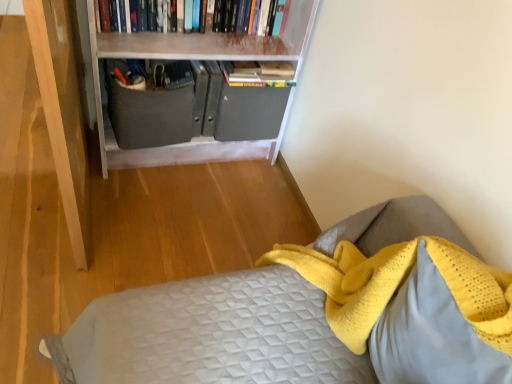
Describe the element at coordinates (431, 335) in the screenshot. This screenshot has width=512, height=384. I see `yellow knitted pillow at lower right` at that location.

The width and height of the screenshot is (512, 384). Identify the location of yellow knitted pillow at lower right. (431, 335).

Find the location of a particular element. This screenshot has width=512, height=384. hardcover books at upper center is located at coordinates (248, 16).

Where is `white matte bookcase at upper center`? white matte bookcase at upper center is located at coordinates (199, 91).

Who is taller, matte gray drawer at center or hardcover books at upper center?

matte gray drawer at center is taller.

Is matte gray drawer at center positioned with its back to hardcover books at upper center?

matte gray drawer at center is not turned away from hardcover books at upper center.

Considering the positions of objects matte gray drawer at center and hardcover books at upper center in the image provided, who is more to the right, matte gray drawer at center or hardcover books at upper center?

hardcover books at upper center.

Is there a large distance between matte gray drawer at center and hardcover books at upper center?

matte gray drawer at center is near hardcover books at upper center, not far away.

Is yellow knitted pillow at lower right wider than matte gray drawer at center?

No, yellow knitted pillow at lower right is not wider than matte gray drawer at center.

Is yellow knitted pillow at lower right facing towards matte gray drawer at center?

No, yellow knitted pillow at lower right is not oriented towards matte gray drawer at center.

Is yellow knitted pillow at lower right taller than matte gray drawer at center?

Indeed, yellow knitted pillow at lower right has a greater height compared to matte gray drawer at center.

Is yellow knitted pillow at lower right directly adjacent to matte gray drawer at center?

No, yellow knitted pillow at lower right is not making contact with matte gray drawer at center.

Measure the distance from yellow knitted pillow at lower right to white matte bookcase at upper center.

A distance of 4.13 feet exists between yellow knitted pillow at lower right and white matte bookcase at upper center.

Is yellow knitted pillow at lower right not within white matte bookcase at upper center?

yellow knitted pillow at lower right is positioned outside white matte bookcase at upper center.

From a real-world perspective, is yellow knitted pillow at lower right physically above white matte bookcase at upper center?

Yes, from a real-world perspective, yellow knitted pillow at lower right is above white matte bookcase at upper center.

I want to click on bookcase that appears above the yellow knitted pillow at lower right (from the image's perspective), so click(x=199, y=91).

Consider the image. Which object is further away from the camera taking this photo, yellow knitted pillow at lower right or hardcover books at upper center?

hardcover books at upper center is behind.

Can hardcover books at upper center be found inside yellow knitted pillow at lower right?

No, hardcover books at upper center is not inside yellow knitted pillow at lower right.

Is point (479, 341) behind point (271, 18)?

No, (479, 341) is closer to viewer.

Is yellow knitted pillow at lower right bigger or smaller than hardcover books at upper center?

In the image, yellow knitted pillow at lower right appears to be smaller than hardcover books at upper center.

How many degrees apart are the facing directions of matte gray drawer at center and yellow knitted pillow at lower right?

The angular difference between matte gray drawer at center and yellow knitted pillow at lower right is 95.8 degrees.

Considering the relative positions of matte gray drawer at center and yellow knitted pillow at lower right in the image provided, is matte gray drawer at center to the right of yellow knitted pillow at lower right from the viewer's perspective?

No, matte gray drawer at center is not to the right of yellow knitted pillow at lower right.

Considering the points (172, 132) and (487, 365), which point is behind, point (172, 132) or point (487, 365)?

The point (172, 132) is behind.

Locate an element on the screen. book behind the yellow knitted pillow at lower right is located at coordinates click(248, 16).

Is hardcover books at upper center smaller than yellow knitted pillow at lower right?

Actually, hardcover books at upper center might be larger than yellow knitted pillow at lower right.

From a real-world perspective, between hardcover books at upper center and yellow knitted pillow at lower right, who is vertically higher?

From a 3D spatial view, hardcover books at upper center is above.

Is hardcover books at upper center taller than yellow knitted pillow at lower right?

No, hardcover books at upper center is not taller than yellow knitted pillow at lower right.

Considering the sizes of objects white matte bookcase at upper center and yellow knitted pillow at lower right in the image provided, who is bigger, white matte bookcase at upper center or yellow knitted pillow at lower right?

Bigger between the two is white matte bookcase at upper center.

What's the angular difference between white matte bookcase at upper center and yellow knitted pillow at lower right's facing directions?

There is a 93.4-degree angle between the facing directions of white matte bookcase at upper center and yellow knitted pillow at lower right.

Does white matte bookcase at upper center turn towards yellow knitted pillow at lower right?

Yes, white matte bookcase at upper center is facing yellow knitted pillow at lower right.

Is white matte bookcase at upper center thinner than yellow knitted pillow at lower right?

No.

The height and width of the screenshot is (384, 512). I want to click on book positioned vertically above the matte gray drawer at center (from a real-world perspective), so click(x=248, y=16).

The height and width of the screenshot is (384, 512). Find the location of `pillow in front of the matte gray drawer at center`. pillow in front of the matte gray drawer at center is located at coordinates (431, 335).

Based on their spatial positions, is white matte bookcase at upper center or matte gray drawer at center further from yellow knitted pillow at lower right?

The object further to yellow knitted pillow at lower right is matte gray drawer at center.

Looking at the image, which one is located further to white matte bookcase at upper center, matte gray drawer at center or hardcover books at upper center?

hardcover books at upper center.

Looking at the image, which one is located closer to white matte bookcase at upper center, yellow knitted pillow at lower right or hardcover books at upper center?

Based on the image, hardcover books at upper center appears to be nearer to white matte bookcase at upper center.

Considering their positions, is white matte bookcase at upper center positioned closer to yellow knitted pillow at lower right than hardcover books at upper center?

white matte bookcase at upper center is positioned closer to the anchor yellow knitted pillow at lower right.

Which object lies nearer to the anchor point white matte bookcase at upper center, yellow knitted pillow at lower right or matte gray drawer at center?

matte gray drawer at center is positioned closer to the anchor white matte bookcase at upper center.

When comparing their distances from hardcover books at upper center, does white matte bookcase at upper center or matte gray drawer at center seem closer?

Among the two, white matte bookcase at upper center is located nearer to hardcover books at upper center.

Which object lies further to the anchor point matte gray drawer at center, yellow knitted pillow at lower right or hardcover books at upper center?

yellow knitted pillow at lower right lies further to matte gray drawer at center than the other object.

Based on their spatial positions, is matte gray drawer at center or white matte bookcase at upper center closer to yellow knitted pillow at lower right?

Among the two, white matte bookcase at upper center is located nearer to yellow knitted pillow at lower right.

Image resolution: width=512 pixels, height=384 pixels. What are the coordinates of `bookcase between hardcover books at upper center and yellow knitted pillow at lower right vertically` in the screenshot? It's located at (199, 91).

Where is `bookcase between hardcover books at upper center and matte gray drawer at center vertically`? bookcase between hardcover books at upper center and matte gray drawer at center vertically is located at coordinates (199, 91).

Identify the location of bookcase between yellow knitted pillow at lower right and matte gray drawer at center in the front-back direction. (199, 91).

You are a GUI agent. You are given a task and a screenshot of the screen. Output one action in this format:
    pyautogui.click(x=<x>, y=<y>)
    Task: Click on the drawer between hardcover books at upper center and yellow knitted pillow at lower right in the up-down direction
    
    Given the screenshot: What is the action you would take?
    pyautogui.click(x=150, y=115)